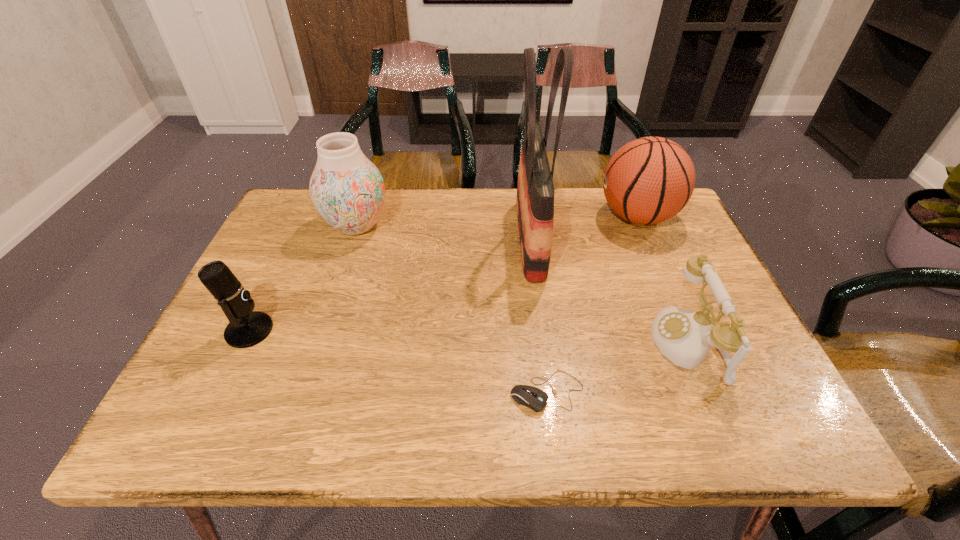
The height and width of the screenshot is (540, 960). In order to click on basketball at the far edge in this screenshot , I will do `click(649, 180)`.

What are the coordinates of `object that is positioned at the near edge` in the screenshot? It's located at (534, 398).

At what (x,y) coordinates should I click in order to perform the action: click on vase that is positioned at the left edge. Please return your answer as a coordinate pair (x, y). Looking at the image, I should click on (347, 189).

Find the location of `microphone present at the left edge`. microphone present at the left edge is located at coordinates (247, 328).

Image resolution: width=960 pixels, height=540 pixels. In order to click on basketball at the right edge in this screenshot , I will do pos(649,180).

Identify the location of telephone at the right edge. (685, 337).

Find the location of a particular element. object situated at the far left corner is located at coordinates (347, 189).

This screenshot has height=540, width=960. Identify the location of object at the far right corner. (649, 180).

Find the location of a particular element. The image size is (960, 540). vacant position at the far edge of the desktop is located at coordinates (596, 197).

Identify the location of vacant position at the near edge of the desktop. This screenshot has height=540, width=960. (451, 418).